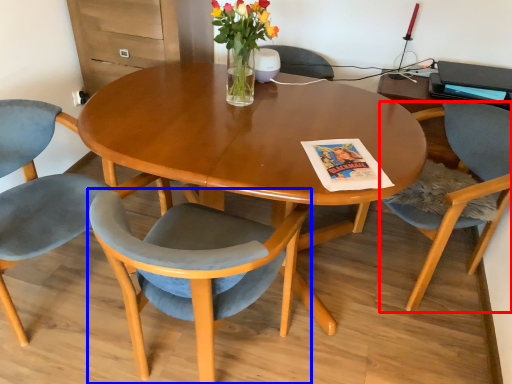
Question: Which of the following is the farthest to the observer, chair (highlighted by a red box) or chair (highlighted by a blue box)?

Choices:
 (A) chair
 (B) chair

Answer: (A)